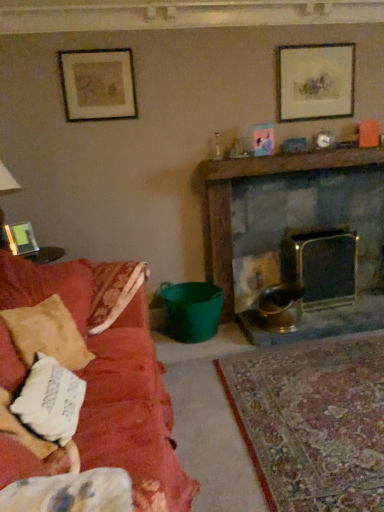
Question: From a real-world perspective, is matte glass picture frame at left, the first picture frame in the bottom-to-top sequence, physically located above or below matte gold picture frame at upper left, which is the 2th picture frame from bottom to top?

Choices:
 (A) below
 (B) above

Answer: (A)

Question: From their relative heights in the image, would you say matte glass picture frame at left, the 3th picture frame when ordered from right to left, is taller or shorter than matte gold picture frame at upper left, which is the 2th picture frame from bottom to top?

Choices:
 (A) short
 (B) tall

Answer: (A)

Question: Based on their relative distances, which object is farther from the white cotton pillow at left?

Choices:
 (A) matte black picture frame at upper right, which is the 3th picture frame from left to right
 (B) velvet red couch at left
 (C) wooden mantel at upper center
 (D) matte gold picture frame at upper left, arranged as the 2th picture frame when viewed from the right
 (E) matte glass picture frame at left, the 3th picture frame when ordered from right to left

Answer: (A)

Question: Which object is the farthest from the matte black picture frame at upper right, which appears as the 1th picture frame when viewed from the right?

Choices:
 (A) matte gold picture frame at upper left, acting as the 2th picture frame starting from the left
 (B) white cotton pillow at left
 (C) velvet red couch at left
 (D) dark gray stone fireplace at center right
 (E) wooden mantel at upper center

Answer: (B)